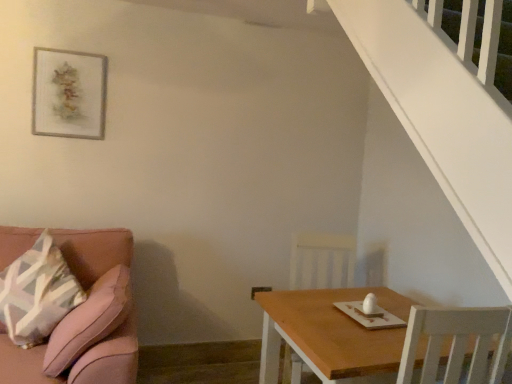
Question: Should I look upward or downward to see wooden picture frame at upper left?

Choices:
 (A) up
 (B) down

Answer: (A)

Question: Does wooden chair at lower right have a smaller size compared to wooden table at lower right?

Choices:
 (A) no
 (B) yes

Answer: (B)

Question: Is wooden chair at lower right turned away from wooden table at lower right?

Choices:
 (A) yes
 (B) no

Answer: (A)

Question: Does wooden chair at lower right lie in front of wooden table at lower right?

Choices:
 (A) no
 (B) yes

Answer: (A)

Question: From the image's perspective, is wooden chair at lower right below wooden table at lower right?

Choices:
 (A) no
 (B) yes

Answer: (A)

Question: Would you consider wooden chair at lower right to be distant from wooden table at lower right?

Choices:
 (A) no
 (B) yes

Answer: (A)

Question: From a real-world perspective, is wooden chair at lower right beneath wooden table at lower right?

Choices:
 (A) yes
 (B) no

Answer: (B)

Question: Does wooden picture frame at upper left have a lesser width compared to wooden chair at lower right?

Choices:
 (A) yes
 (B) no

Answer: (A)

Question: Can you confirm if wooden picture frame at upper left is positioned to the right of wooden chair at lower right?

Choices:
 (A) no
 (B) yes

Answer: (A)

Question: Is wooden picture frame at upper left wider than wooden chair at lower right?

Choices:
 (A) yes
 (B) no

Answer: (B)

Question: From the image's perspective, is wooden picture frame at upper left located above wooden chair at lower right?

Choices:
 (A) yes
 (B) no

Answer: (A)

Question: Considering the relative sizes of wooden picture frame at upper left and wooden chair at lower right in the image provided, is wooden picture frame at upper left smaller than wooden chair at lower right?

Choices:
 (A) yes
 (B) no

Answer: (A)

Question: From the image's perspective, is wooden picture frame at upper left located beneath wooden chair at lower right?

Choices:
 (A) yes
 (B) no

Answer: (B)

Question: Considering the relative sizes of wooden table at lower right and wooden chair at lower right in the image provided, is wooden table at lower right taller than wooden chair at lower right?

Choices:
 (A) no
 (B) yes

Answer: (A)